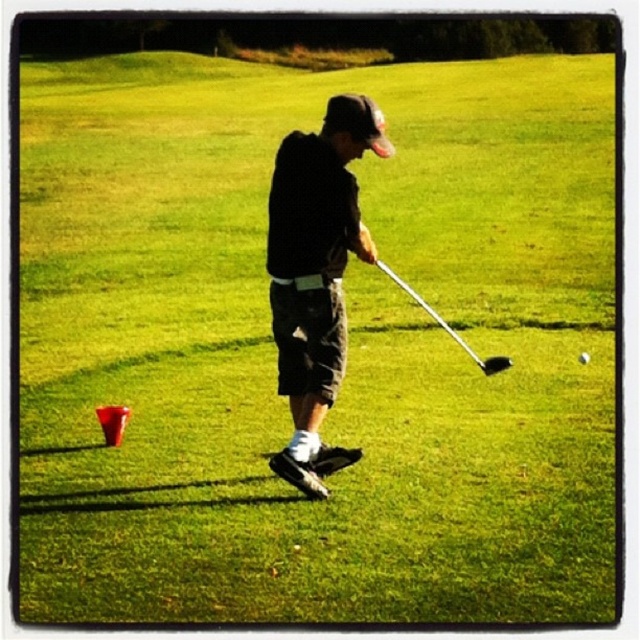
Can you confirm if black matte golf club at center is wider than metallic silver golf club at center?

Correct, the width of black matte golf club at center exceeds that of metallic silver golf club at center.

Which is above, black matte golf club at center or metallic silver golf club at center?

black matte golf club at center is higher up.

Measure the distance between black matte golf club at center and camera.

6.77 meters

This screenshot has width=640, height=640. In order to click on black matte golf club at center in this screenshot , I will do `click(316, 275)`.

Does black matte golf club at center have a larger size compared to glossy black golf club at center?

Indeed, black matte golf club at center has a larger size compared to glossy black golf club at center.

Does point (307, 320) come behind point (588, 355)?

That is False.

Identify the location of black matte golf club at center. (316, 275).

Which is in front, point (477, 362) or point (580, 356)?

Point (477, 362)

Which is more to the left, metallic silver golf club at center or glossy black golf club at center?

metallic silver golf club at center is more to the left.

Between point (401, 282) and point (586, 352), which one is positioned behind?

Positioned behind is point (401, 282).

The image size is (640, 640). I want to click on metallic silver golf club at center, so click(x=449, y=326).